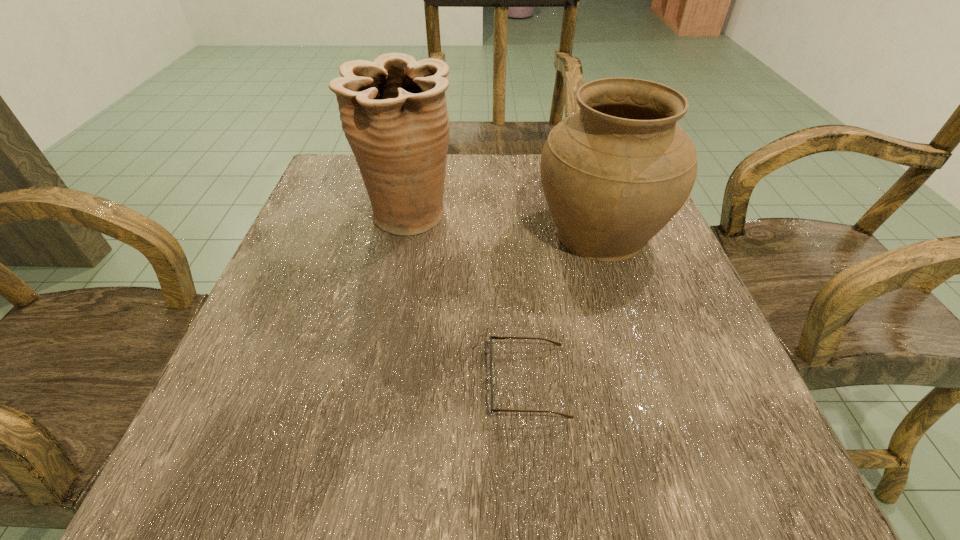
In order to click on free point between the right urn and the spectacles in this screenshot , I will do `click(564, 307)`.

Locate an element on the screen. The image size is (960, 540). empty space that is in between the nearest object and the right urn is located at coordinates (564, 307).

Locate an element on the screen. The image size is (960, 540). empty location between the spectacles and the right urn is located at coordinates click(x=564, y=307).

Locate an element on the screen. vacant point located between the nearest object and the left urn is located at coordinates pyautogui.click(x=469, y=298).

I want to click on vacant point located between the right urn and the left urn, so click(x=505, y=225).

Image resolution: width=960 pixels, height=540 pixels. In order to click on empty space between the right urn and the left urn in this screenshot , I will do `click(505, 225)`.

Locate an element on the screen. blank region between the left urn and the right urn is located at coordinates point(505,225).

This screenshot has width=960, height=540. I want to click on object that can be found as the second closest to the left urn, so pyautogui.click(x=492, y=380).

The height and width of the screenshot is (540, 960). What are the coordinates of `object that is the closest to the leftmost object` in the screenshot? It's located at click(x=614, y=173).

At what (x,y) coordinates should I click in order to perform the action: click on vacant space that satisfies the following two spatial constraints: 1. on the front side of the leftmost object; 2. on the right side of the right urn. Please return your answer as a coordinate pair (x, y). This screenshot has width=960, height=540. Looking at the image, I should click on (407, 233).